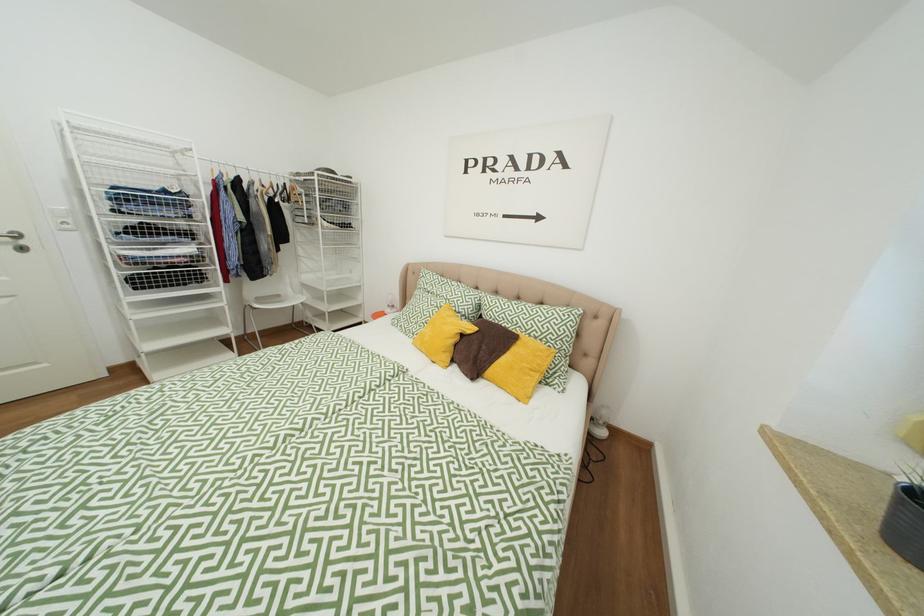
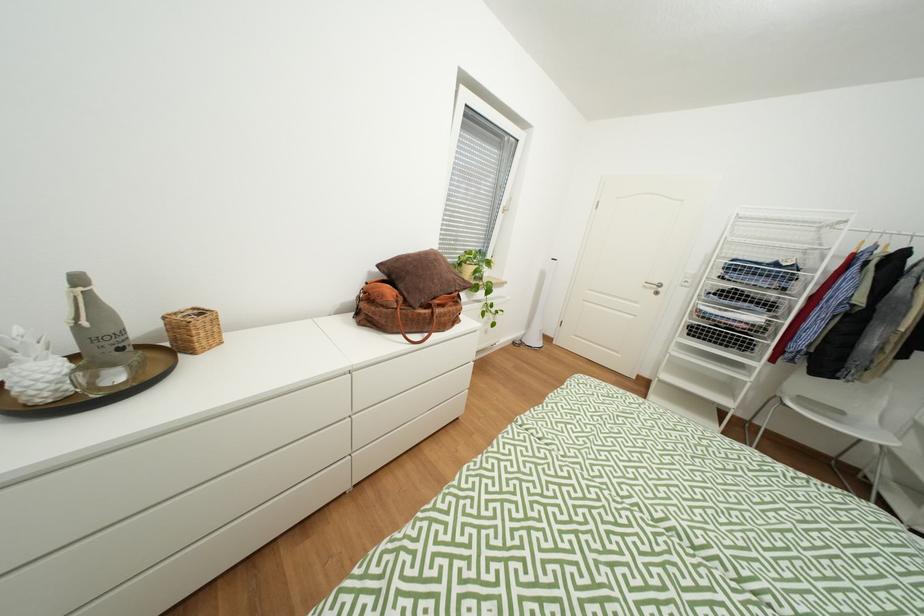
How did the camera likely rotate?

The camera rotated toward left-down.